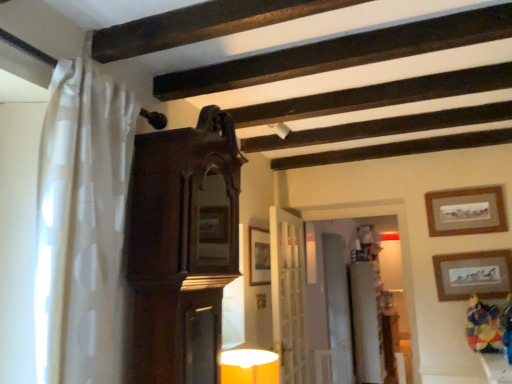
Question: Would you say matte yellow glass table lamp at lower center is to the left or to the right of wooden picture frame at center, which ranks as the 1th picture frame in left-to-right order, in the picture?

Choices:
 (A) right
 (B) left

Answer: (B)

Question: From a real-world perspective, is matte yellow glass table lamp at lower center physically located above or below wooden picture frame at center, which ranks as the 1th picture frame in left-to-right order?

Choices:
 (A) below
 (B) above

Answer: (A)

Question: Which of these objects is positioned farthest from the wooden picture frame at center, which ranks as the 1th picture frame in left-to-right order?

Choices:
 (A) white glossy dresser at center
 (B) matte yellow glass table lamp at lower center
 (C) matte gold picture frame at upper right, the 1th picture frame positioned from the right
 (D) dark wood cabinet at center
 (E) wooden framed picture at upper right, the second picture frame viewed from the left

Answer: (A)

Question: Estimate the real-world distances between objects in this image. Which object is closer to the white glossy dresser at center?

Choices:
 (A) matte yellow glass table lamp at lower center
 (B) white sheer curtain at left
 (C) wooden framed picture at upper right, the second picture frame viewed from the left
 (D) matte gold picture frame at upper right, placed as the 3th picture frame when sorted from left to right
 (E) dark wood cabinet at center

Answer: (D)